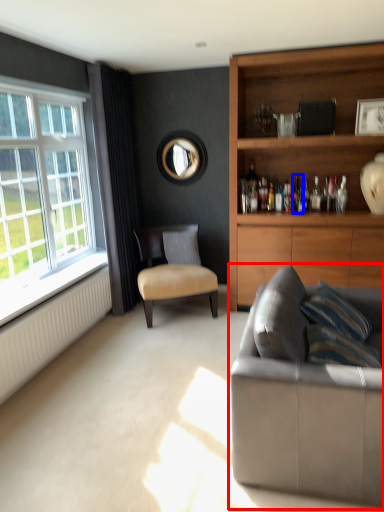
Question: Among these objects, which one is nearest to the camera, studio couch (highlighted by a red box) or bottle (highlighted by a blue box)?

Choices:
 (A) studio couch
 (B) bottle

Answer: (A)